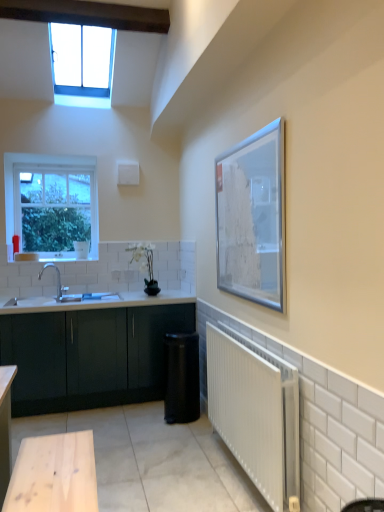
You are a GUI agent. You are given a task and a screenshot of the screen. Output one action in this format:
    pyautogui.click(x=<x>, y=<y>)
    Task: Click on the vacant region to the left of black matte water heater at lower right
    The image size is (384, 512).
    Given the screenshot: What is the action you would take?
    pyautogui.click(x=148, y=418)